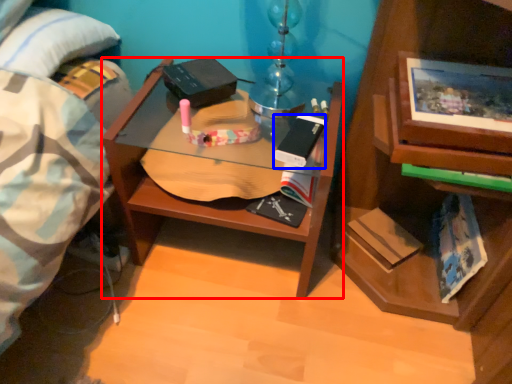
Question: Which point is closer to the camera, desk (highlighted by a red box) or paperback book (highlighted by a blue box)?

Choices:
 (A) desk
 (B) paperback book

Answer: (A)